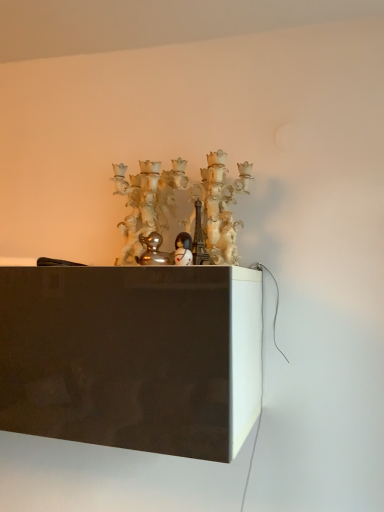
Question: Is shiny silver duckling at center, placed as the second toy when sorted from right to left, not inside white glossy figurine at center, which ranks as the 2th toy in left-to-right order?

Choices:
 (A) no
 (B) yes

Answer: (B)

Question: Considering the relative sizes of shiny silver duckling at center, placed as the second toy when sorted from right to left, and white glossy figurine at center, which is the 1th toy in right-to-left order, in the image provided, is shiny silver duckling at center, placed as the second toy when sorted from right to left, smaller than white glossy figurine at center, which is the 1th toy in right-to-left order,?

Choices:
 (A) yes
 (B) no

Answer: (B)

Question: Would you say shiny silver duckling at center, which is counted as the 1th toy, starting from the left, contains white glossy figurine at center, which ranks as the 2th toy in left-to-right order?

Choices:
 (A) yes
 (B) no

Answer: (B)

Question: Is shiny silver duckling at center, placed as the second toy when sorted from right to left, oriented towards white glossy figurine at center, which is the 1th toy in right-to-left order?

Choices:
 (A) no
 (B) yes

Answer: (A)

Question: Does shiny silver duckling at center, which is counted as the 1th toy, starting from the left, come in front of white glossy figurine at center, which ranks as the 2th toy in left-to-right order?

Choices:
 (A) no
 (B) yes

Answer: (A)

Question: Is shiny silver duckling at center, placed as the second toy when sorted from right to left, taller than white glossy figurine at center, which ranks as the 2th toy in left-to-right order?

Choices:
 (A) no
 (B) yes

Answer: (B)

Question: Would you say white glossy figurine at center, which is the 1th toy in right-to-left order, contains shiny silver duckling at center, which is counted as the 1th toy, starting from the left?

Choices:
 (A) no
 (B) yes

Answer: (A)

Question: Does white glossy figurine at center, which is the 1th toy in right-to-left order, have a greater height compared to shiny silver duckling at center, which is counted as the 1th toy, starting from the left?

Choices:
 (A) yes
 (B) no

Answer: (B)

Question: Are white glossy figurine at center, which ranks as the 2th toy in left-to-right order, and shiny silver duckling at center, which is counted as the 1th toy, starting from the left, located far from each other?

Choices:
 (A) no
 (B) yes

Answer: (A)

Question: Is white glossy figurine at center, which ranks as the 2th toy in left-to-right order, looking in the opposite direction of shiny silver duckling at center, placed as the second toy when sorted from right to left?

Choices:
 (A) no
 (B) yes

Answer: (A)

Question: From a real-world perspective, is white glossy figurine at center, which ranks as the 2th toy in left-to-right order, over shiny silver duckling at center, which is counted as the 1th toy, starting from the left?

Choices:
 (A) yes
 (B) no

Answer: (B)

Question: Can you confirm if white glossy figurine at center, which ranks as the 2th toy in left-to-right order, is bigger than shiny silver duckling at center, placed as the second toy when sorted from right to left?

Choices:
 (A) yes
 (B) no

Answer: (B)

Question: Is translucent glass chandelier at center touching shiny silver duckling at center, placed as the second toy when sorted from right to left?

Choices:
 (A) yes
 (B) no

Answer: (B)